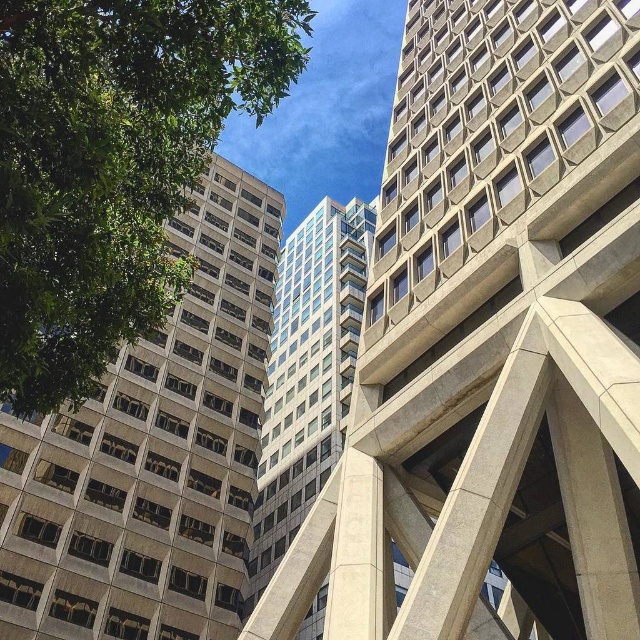
This screenshot has height=640, width=640. What do you see at coordinates (492, 340) in the screenshot? I see `concrete textured building at center` at bounding box center [492, 340].

Which is in front, point (563, 474) or point (124, 285)?

Point (124, 285) is more forward.

Where is `concrete textured building at center`? The image size is (640, 640). concrete textured building at center is located at coordinates (492, 340).

From the picture: How far apart are concrete textured building at center and gray concrete building at left?

concrete textured building at center and gray concrete building at left are 20.63 meters apart.

Between point (349, 618) and point (109, 426), which one is positioned in front?

Point (349, 618) is more forward.

This screenshot has width=640, height=640. Describe the element at coordinates (492, 340) in the screenshot. I see `concrete textured building at center` at that location.

I want to click on concrete textured building at center, so click(x=492, y=340).

Is concrete textured building at center above glassy concrete building at center?

Yes, concrete textured building at center is above glassy concrete building at center.

Identify the location of concrete textured building at center. (492, 340).

I want to click on concrete textured building at center, so click(492, 340).